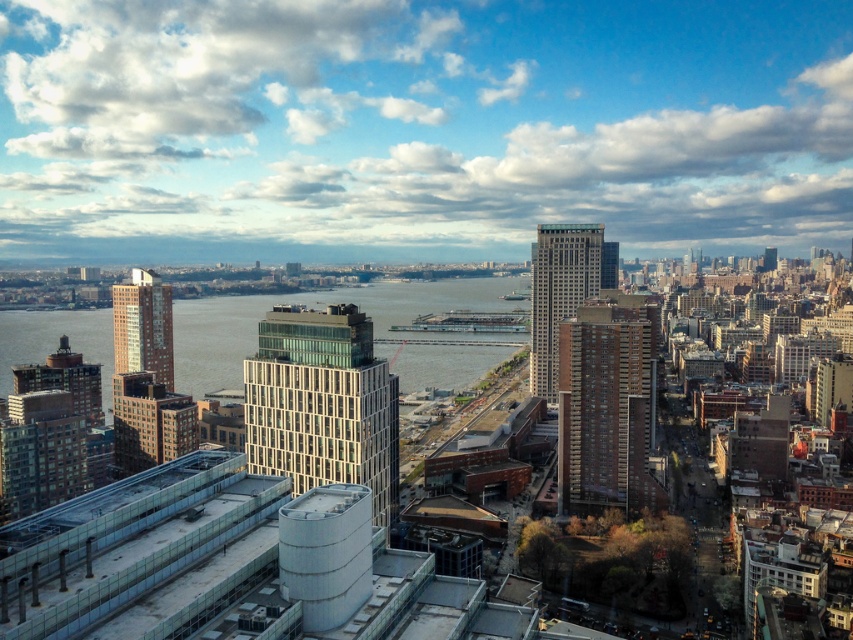
Is point (595, 435) farther from camera compared to point (553, 316)?

No, (595, 435) is closer to viewer.

Locate an element on the screen. The image size is (853, 640). brown brick building at center-right is located at coordinates (607, 404).

Which is behind, point (312, 444) or point (149, 355)?

Positioned behind is point (149, 355).

Is point (279, 307) in front of point (158, 362)?

Yes, it is.

The width and height of the screenshot is (853, 640). Identify the location of glassy modern building at center. (322, 403).

Can you confirm if glassy modern building at center is taller than glassy steel skyscraper at center?

Incorrect, glassy modern building at center's height is not larger of glassy steel skyscraper at center's.

Who is more forward, (318, 369) or (550, 259)?

Point (318, 369)

Which is in front, point (267, 468) or point (595, 246)?

Point (267, 468) is more forward.

This screenshot has height=640, width=853. What are the coordinates of `glassy modern building at center` in the screenshot? It's located at (322, 403).